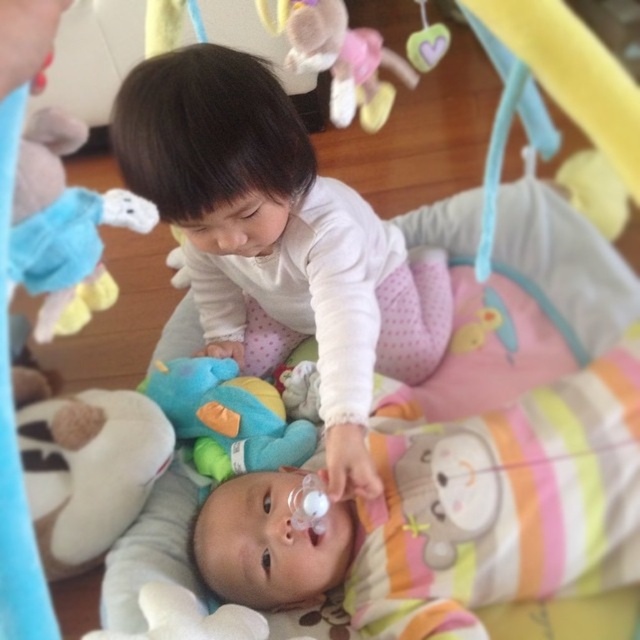
Does smooth white toddler at center have a greater width compared to soft plush elephant at upper left?

Correct, the width of smooth white toddler at center exceeds that of soft plush elephant at upper left.

Which is below, smooth white toddler at center or soft plush elephant at upper left?

Positioned lower is soft plush elephant at upper left.

Does point (328, 202) lie in front of point (81, 324)?

No, (328, 202) is further to viewer.

Find the location of `smooth white toddler at center`. smooth white toddler at center is located at coordinates (280, 241).

Is smooth white toddler at center taller than soft plush toy at center?

Correct, smooth white toddler at center is much taller as soft plush toy at center.

Locate an element on the screen. The height and width of the screenshot is (640, 640). smooth white toddler at center is located at coordinates (280, 241).

Where is `smooth white toddler at center`? Image resolution: width=640 pixels, height=640 pixels. smooth white toddler at center is located at coordinates (280, 241).

Which is above, smooth white toddler at center or white plush toy at lower left?

Positioned higher is smooth white toddler at center.

Which of these two, smooth white toddler at center or white plush toy at lower left, stands shorter?

With less height is white plush toy at lower left.

What are the coordinates of `smooth white toddler at center` in the screenshot? It's located at (280, 241).

Image resolution: width=640 pixels, height=640 pixels. Find the location of `smooth white toddler at center`. smooth white toddler at center is located at coordinates (280, 241).